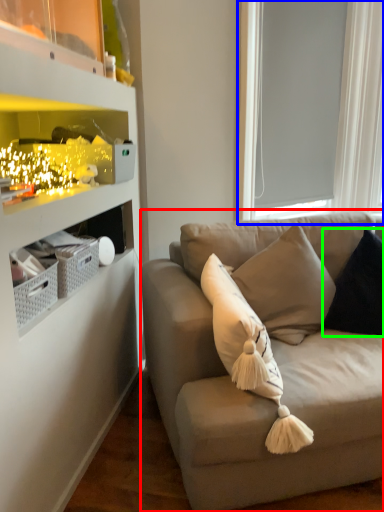
Question: Which object is positioned farthest from studio couch (highlighted by a red box)? Select from window screen (highlighted by a blue box) and pillow (highlighted by a green box).

Choices:
 (A) window screen
 (B) pillow

Answer: (A)